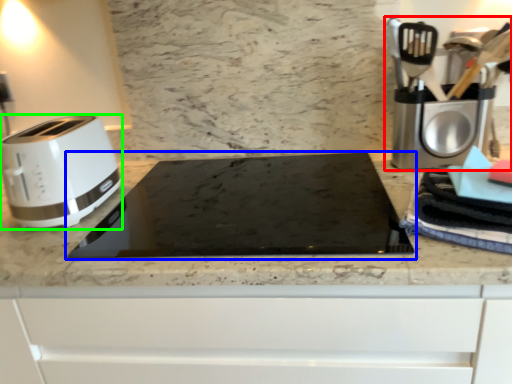
Question: Based on their relative distances, which object is farther from coffee machine (highlighted by a red box)? Choose from home appliance (highlighted by a blue box) and toaster (highlighted by a green box).

Choices:
 (A) home appliance
 (B) toaster

Answer: (B)